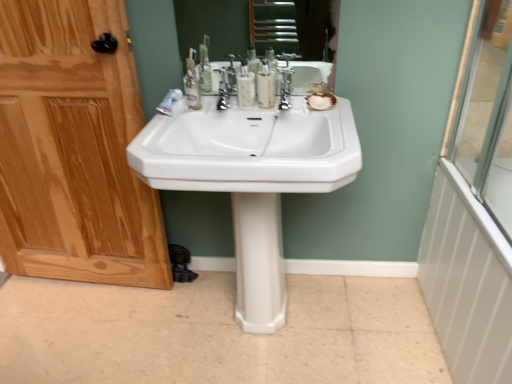
Question: Is white glossy pedestal at center taller than transparent glass shower door at right?

Choices:
 (A) no
 (B) yes

Answer: (B)

Question: Is white glossy pedestal at center completely or partially outside of transparent glass shower door at right?

Choices:
 (A) yes
 (B) no

Answer: (A)

Question: Can you confirm if white glossy pedestal at center is thinner than transparent glass shower door at right?

Choices:
 (A) yes
 (B) no

Answer: (B)

Question: Considering the relative sizes of white glossy pedestal at center and transparent glass shower door at right in the image provided, is white glossy pedestal at center wider than transparent glass shower door at right?

Choices:
 (A) no
 (B) yes

Answer: (B)

Question: Is transparent glass shower door at right located within white glossy pedestal at center?

Choices:
 (A) yes
 (B) no

Answer: (B)

Question: In terms of height, does wooden door at left look taller or shorter compared to white glossy toothpaste at center?

Choices:
 (A) short
 (B) tall

Answer: (B)

Question: Considering the positions of wooden door at left and white glossy toothpaste at center in the image, is wooden door at left bigger or smaller than white glossy toothpaste at center?

Choices:
 (A) big
 (B) small

Answer: (A)

Question: Is point (13, 150) positioned closer to the camera than point (163, 107)?

Choices:
 (A) closer
 (B) farther

Answer: (B)

Question: Is wooden door at left inside the boundaries of white glossy toothpaste at center, or outside?

Choices:
 (A) outside
 (B) inside

Answer: (A)

Question: In terms of width, does white glossy toothpaste at center look wider or thinner when compared to white glossy radiator at right?

Choices:
 (A) thin
 (B) wide

Answer: (B)

Question: Considering the positions of white glossy toothpaste at center and white glossy radiator at right in the image, is white glossy toothpaste at center bigger or smaller than white glossy radiator at right?

Choices:
 (A) small
 (B) big

Answer: (A)

Question: Is white glossy toothpaste at center taller or shorter than white glossy radiator at right?

Choices:
 (A) tall
 (B) short

Answer: (B)

Question: From the image's perspective, is white glossy toothpaste at center located above or below white glossy radiator at right?

Choices:
 (A) above
 (B) below

Answer: (A)

Question: Considering the relative positions of white glossy radiator at right and translucent plastic mouthwash at center, the second mouthwash from the right, in the image provided, is white glossy radiator at right to the left or to the right of translucent plastic mouthwash at center, the second mouthwash from the right,?

Choices:
 (A) left
 (B) right

Answer: (B)

Question: Is point click(477, 253) closer or farther from the camera than point click(246, 92)?

Choices:
 (A) farther
 (B) closer

Answer: (B)